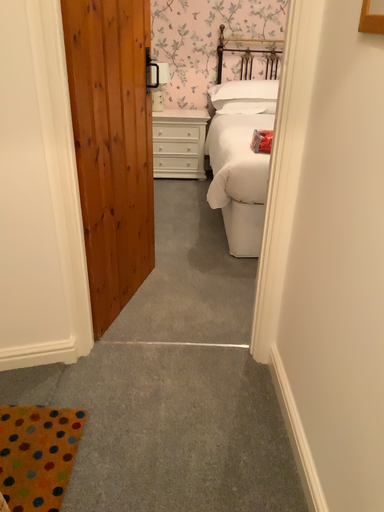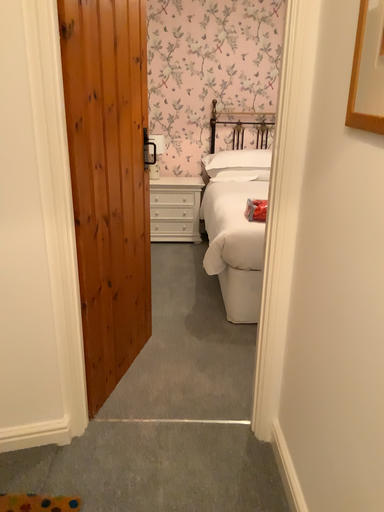
Question: Which way did the camera rotate in the video?

Choices:
 (A) rotated upward
 (B) rotated downward

Answer: (A)